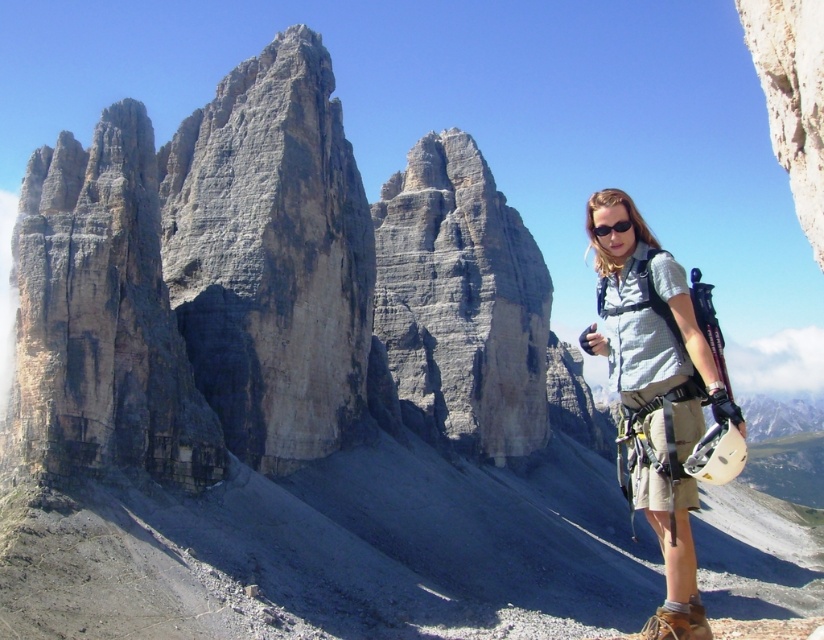
Question: Which point is farther to the camera?

Choices:
 (A) (607, 227)
 (B) (677, 557)

Answer: (A)

Question: Does light gray mesh shirt at right appear on the right side of black matte sunglasses at right?

Choices:
 (A) no
 (B) yes

Answer: (B)

Question: Which object appears closest to the camera in this image?

Choices:
 (A) black matte sunglasses at right
 (B) light gray mesh shirt at right

Answer: (B)

Question: From the image, what is the correct spatial relationship of light gray mesh shirt at right in relation to black matte sunglasses at right?

Choices:
 (A) right
 (B) left

Answer: (A)

Question: Does light gray mesh shirt at right appear on the left side of black matte sunglasses at right?

Choices:
 (A) yes
 (B) no

Answer: (B)